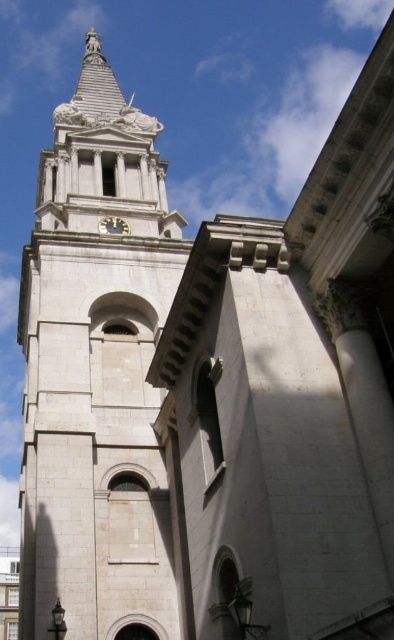
Looking at this image, you are an architect planning to install a new decorative element on the white stone clock tower at center. The element must be placed in a position that ensures it doesn not block the black glossy clock at upper center. Given the spatial relationship between the two objects, where should you position the new element?

Since the white stone clock tower at center is wider than the black glossy clock at upper center, you should position the new decorative element on the sides of the white stone clock tower at center, away from the central area where the black glossy clock at upper center is located. This ensures the clock remains visible and unobstructed.

You are an architect examining the structure of the white stone clock tower at center and the black glossy clock at upper center. Based on their positions, which object is closer to the left side of the image?

The white stone clock tower at center is positioned to the left of the black glossy clock at upper center, so it is closer to the left side of the image.